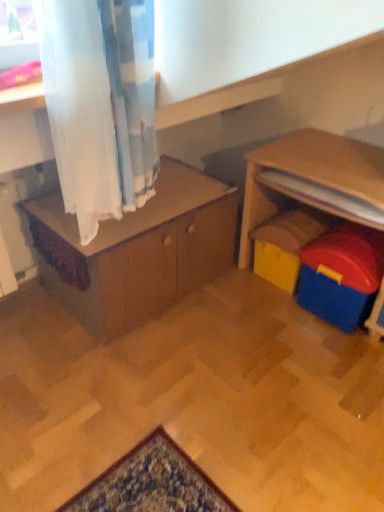
Locate an element on the screen. The width and height of the screenshot is (384, 512). free spot above blue plastic toy at right, which ranks as the 1th toy in front-to-back order (from a real-world perspective) is located at coordinates (361, 241).